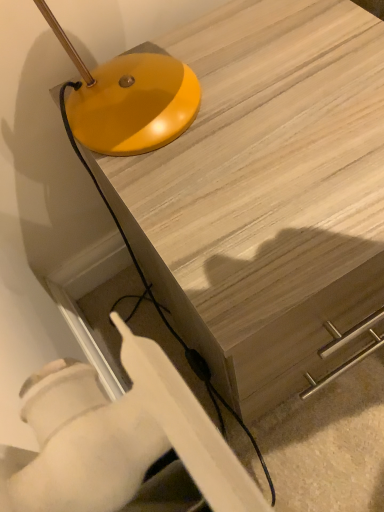
This screenshot has width=384, height=512. Identify the location of vacant area that is in front of matte yellow lampshade at upper left. (229, 194).